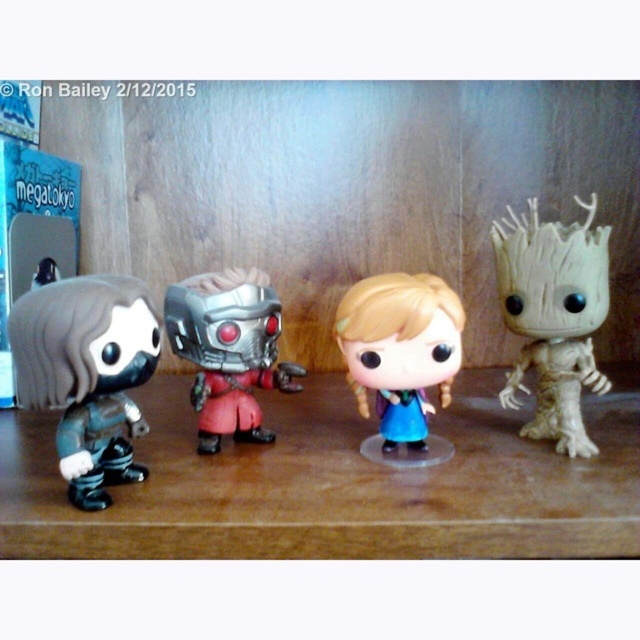
Question: Can you confirm if matte black figure at left is smaller than blonde hair plastic doll at center?

Choices:
 (A) no
 (B) yes

Answer: (A)

Question: Does matte black figure at left lie behind white textured tree-like figure at right?

Choices:
 (A) yes
 (B) no

Answer: (B)

Question: Which is nearer to the metallic silver robot at center?

Choices:
 (A) white textured tree-like figure at right
 (B) blonde hair plastic doll at center
 (C) matte black figure at left

Answer: (C)

Question: Where is matte black figure at left located in relation to metallic silver robot at center in the image?

Choices:
 (A) above
 (B) below

Answer: (B)

Question: Which point is closer to the camera?

Choices:
 (A) (554, 244)
 (B) (131, 468)

Answer: (A)

Question: Which object is farther from the camera taking this photo?

Choices:
 (A) blonde hair plastic doll at center
 (B) white textured tree-like figure at right

Answer: (B)